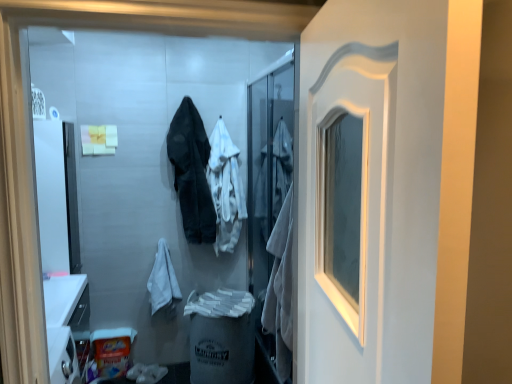
At what (x,y) coordinates should I click in order to perform the action: click on vacant region below white cotton bathrobe at lower left (from a real-world perspective). Please return your answer as a coordinate pair (x, y). Image resolution: width=512 pixels, height=384 pixels. Looking at the image, I should click on (174, 368).